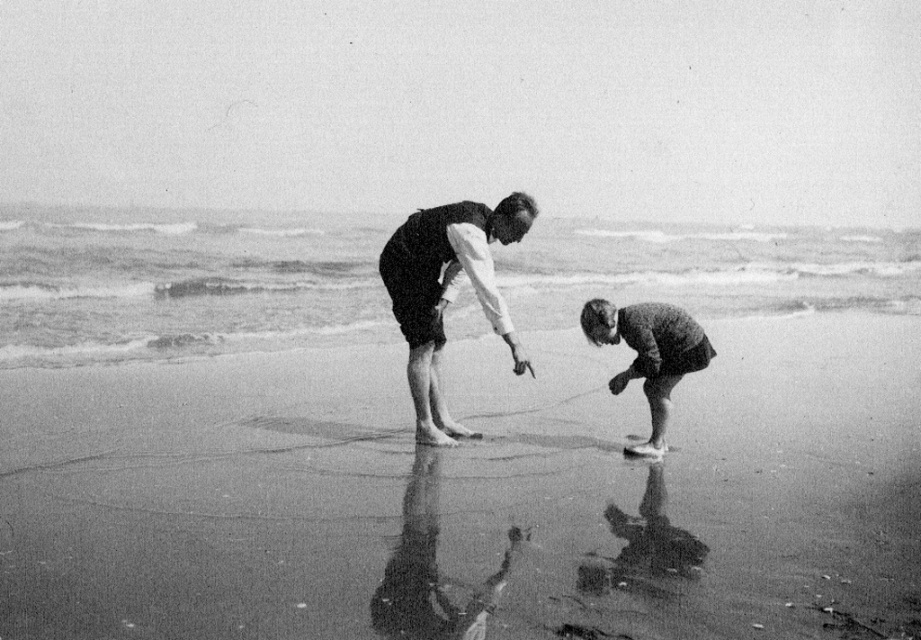
Question: Is smooth sand at lower center bigger than coarse wool sweater at lower right?

Choices:
 (A) yes
 (B) no

Answer: (A)

Question: Which point is farther from the camera taking this photo?

Choices:
 (A) (508, 317)
 (B) (655, 342)
 (C) (529, 596)

Answer: (A)

Question: Does smooth fabric shorts at center appear on the right side of coarse wool sweater at lower right?

Choices:
 (A) yes
 (B) no

Answer: (B)

Question: Where is smooth sand at lower center located in relation to coarse wool sweater at lower right in the image?

Choices:
 (A) right
 (B) left

Answer: (B)

Question: Which object is positioned farthest from the smooth fabric shorts at center?

Choices:
 (A) coarse wool sweater at lower right
 (B) smooth sand at lower center

Answer: (B)

Question: Which of these objects is positioned farthest from the coarse wool sweater at lower right?

Choices:
 (A) smooth sand at lower center
 (B) smooth fabric shorts at center

Answer: (A)